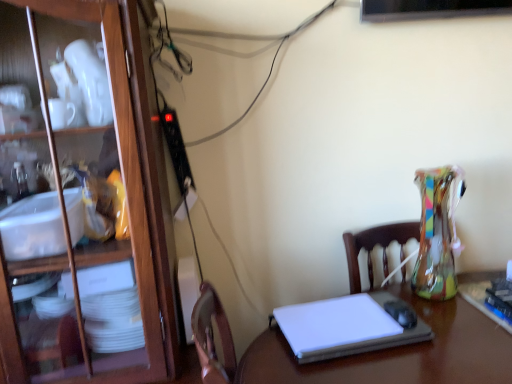
Question: From a real-world perspective, is white glossy desk at center positioned above or below wooden cabinet at left?

Choices:
 (A) below
 (B) above

Answer: (A)

Question: Considering the relative positions of white glossy desk at center and wooden cabinet at left in the image provided, is white glossy desk at center to the left or to the right of wooden cabinet at left?

Choices:
 (A) right
 (B) left

Answer: (A)

Question: Which is nearer to the wooden cabinet at left?

Choices:
 (A) white glossy desk at center
 (B) white matte laptop at center

Answer: (B)

Question: Estimate the real-world distances between objects in this image. Which object is closer to the white glossy desk at center?

Choices:
 (A) wooden cabinet at left
 (B) white matte laptop at center

Answer: (B)